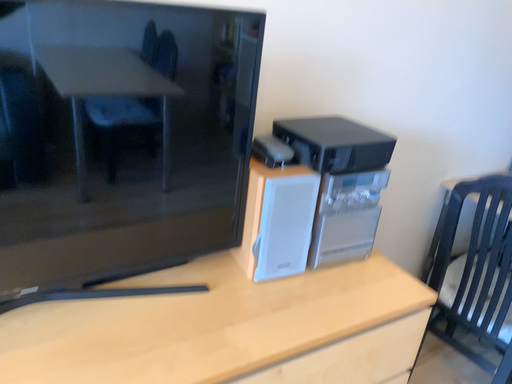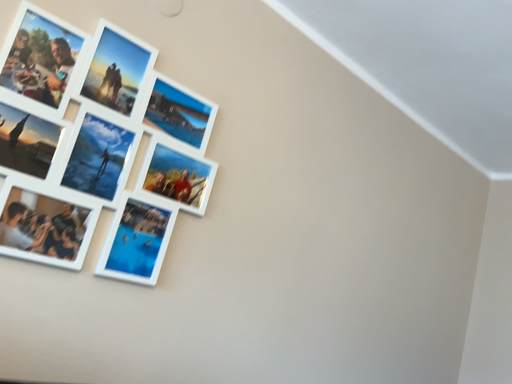
Question: Which way did the camera rotate in the video?

Choices:
 (A) rotated upward
 (B) rotated downward

Answer: (A)